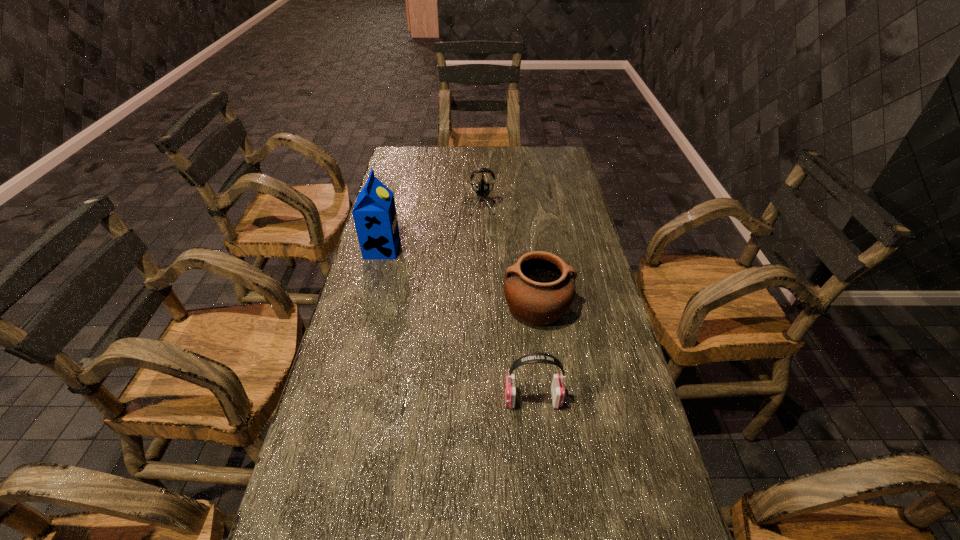
Where is `vacant space located on the outer surface of the nearer earphone`? vacant space located on the outer surface of the nearer earphone is located at coordinates (440, 399).

Where is `vacant space located 0.340m on the outer surface of the nearer earphone`? Image resolution: width=960 pixels, height=540 pixels. vacant space located 0.340m on the outer surface of the nearer earphone is located at coordinates (366, 399).

Locate an element on the screen. The width and height of the screenshot is (960, 540). free space located 0.350m on the front of the third farthest object is located at coordinates (556, 456).

You are a GUI agent. You are given a task and a screenshot of the screen. Output one action in this format:
    pyautogui.click(x=<x>, y=<y>)
    Task: Click on the object located in the left edge section of the desktop
    
    Given the screenshot: What is the action you would take?
    pyautogui.click(x=374, y=213)

Image resolution: width=960 pixels, height=540 pixels. What are the coordinates of `object situated at the right edge` in the screenshot? It's located at (539, 288).

Locate an element on the screen. This screenshot has width=960, height=540. vacant area at the far edge of the desktop is located at coordinates (482, 161).

At what (x,y) coordinates should I click in order to perform the action: click on blank space at the left edge of the desktop. Please return your answer as a coordinate pair (x, y). This screenshot has width=960, height=540. Looking at the image, I should click on (396, 199).

In the image, there is a desktop. Identify the location of free space at the right edge. (575, 213).

The width and height of the screenshot is (960, 540). In order to click on vacant region at the far left corner of the desktop in this screenshot , I will do `click(405, 147)`.

The width and height of the screenshot is (960, 540). In the image, there is a desktop. In order to click on blank space at the far right corner in this screenshot , I will do `click(542, 172)`.